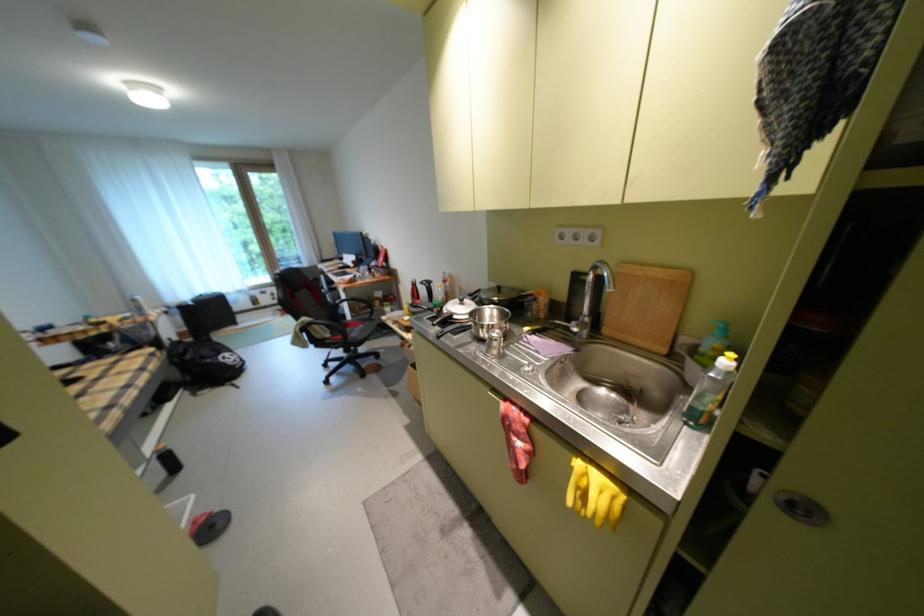
Where is `pot lid handle`? pot lid handle is located at coordinates (503, 296).